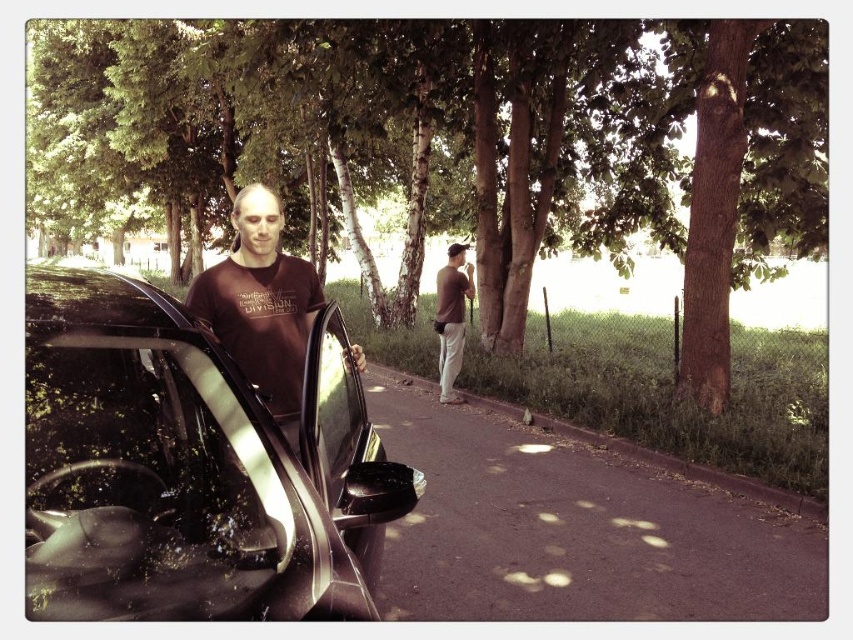
Based on the photo, who is positioned more to the left, shiny black car at left or matte brown t-shirt at center?

matte brown t-shirt at center

Between point (281, 496) and point (241, 241), which one is positioned in front?

Positioned in front is point (281, 496).

Which is in front, point (163, 326) or point (289, 413)?

Point (163, 326)

Locate an element on the screen. The image size is (853, 640). shiny black car at left is located at coordinates (187, 468).

Does point (163, 118) lie in front of point (277, 337)?

No, it is behind (277, 337).

Which is above, brown textured tree at center or matte brown t-shirt at center?

brown textured tree at center

This screenshot has height=640, width=853. What do you see at coordinates (456, 144) in the screenshot?
I see `brown textured tree at center` at bounding box center [456, 144].

What are the coordinates of `brown textured tree at center` in the screenshot? It's located at coord(456,144).

Who is positioned more to the right, matte brown t-shirt at center or brown cotton shirt at center?

Positioned to the right is brown cotton shirt at center.

Can you confirm if matte brown t-shirt at center is wider than brown cotton shirt at center?

Yes, matte brown t-shirt at center is wider than brown cotton shirt at center.

What do you see at coordinates (260, 305) in the screenshot? I see `matte brown t-shirt at center` at bounding box center [260, 305].

The width and height of the screenshot is (853, 640). Identify the location of matte brown t-shirt at center. (260, 305).